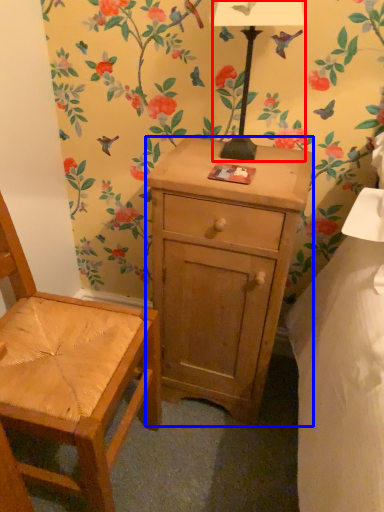
Question: Which object appears farthest to the camera in this image, lamp (highlighted by a red box) or desk (highlighted by a blue box)?

Choices:
 (A) lamp
 (B) desk

Answer: (B)